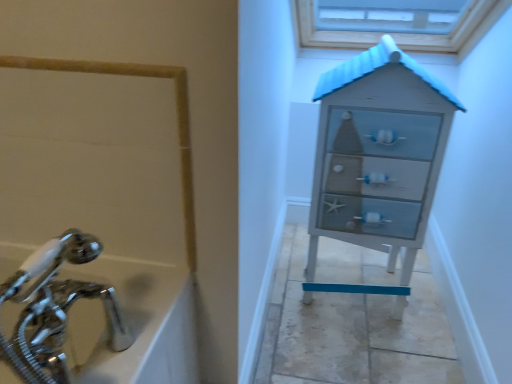
In order to click on vacant region in front of distressed white chest of drawers at right in this screenshot , I will do `click(362, 354)`.